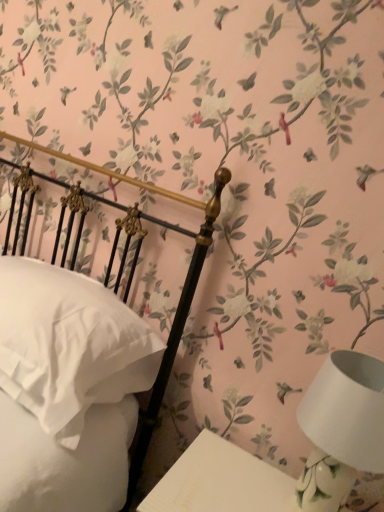
Locate an element on the screen. The image size is (384, 512). free location to the left of white ceramic table lamp at lower right is located at coordinates (225, 475).